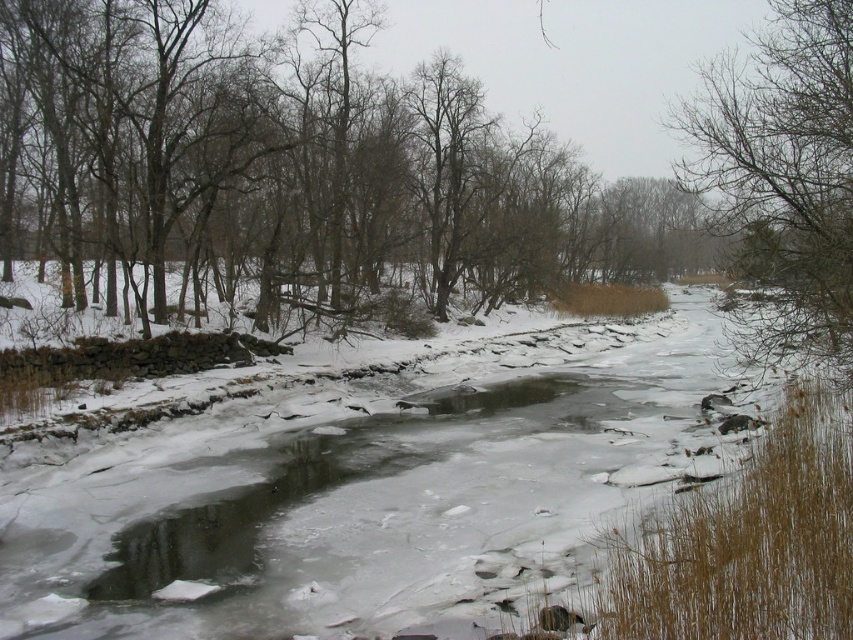
Question: Which object is farther from the camera taking this photo?

Choices:
 (A) brown bark tree at center
 (B) bare branches at upper right

Answer: (A)

Question: Which object is closer to the camera taking this photo?

Choices:
 (A) brown bark tree at center
 (B) bare branches at upper right

Answer: (B)

Question: Where is brown bark tree at center located in relation to bare branches at upper right in the image?

Choices:
 (A) below
 (B) above

Answer: (A)

Question: Is brown bark tree at center positioned behind bare branches at upper right?

Choices:
 (A) no
 (B) yes

Answer: (B)

Question: Can you confirm if brown bark tree at center is smaller than bare branches at upper right?

Choices:
 (A) no
 (B) yes

Answer: (A)

Question: Which point is farther to the camera?

Choices:
 (A) brown bark tree at center
 (B) bare branches at upper right

Answer: (A)